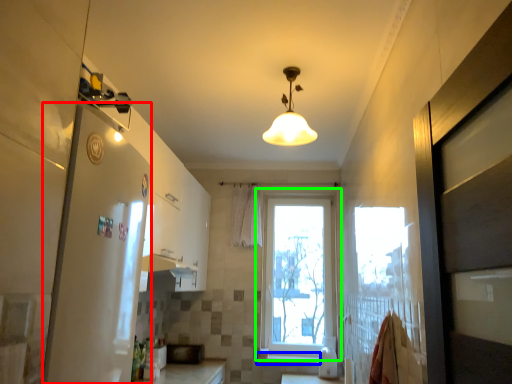
Question: Estimate the real-world distances between objects in this image. Which object is farther from screen door (highlighted by a red box), window sill (highlighted by a blue box) or window (highlighted by a green box)?

Choices:
 (A) window sill
 (B) window

Answer: (A)